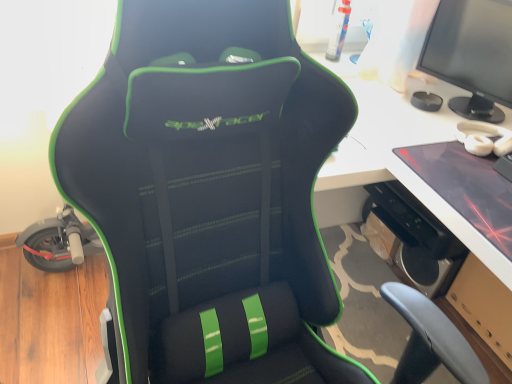
Question: In terms of width, does black matte speaker at lower right look wider or thinner when compared to matte black monitor at upper right?

Choices:
 (A) thin
 (B) wide

Answer: (A)

Question: Is point (458, 263) positioned closer to the camera than point (445, 41)?

Choices:
 (A) farther
 (B) closer

Answer: (A)

Question: Which object is positioned farthest from the matte black monitor at upper right?

Choices:
 (A) white glossy computer desk at center
 (B) black matte speaker at lower right
 (C) matte black laptop at right

Answer: (B)

Question: Estimate the real-world distances between objects in this image. Which object is closer to the white glossy computer desk at center?

Choices:
 (A) matte black monitor at upper right
 (B) black matte speaker at lower right
 (C) matte black laptop at right

Answer: (C)